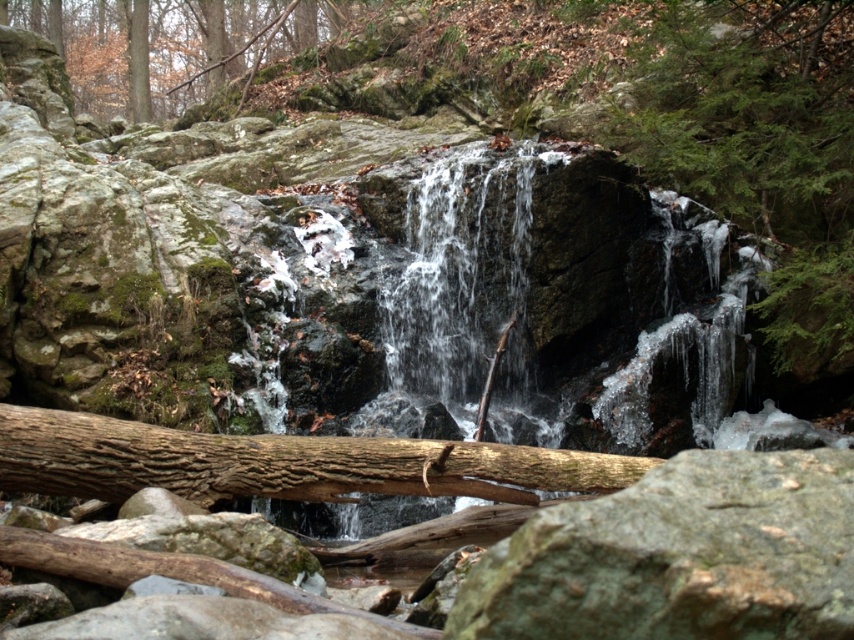
From the picture: Is gray rough rock at center above green textured rock at right?

Incorrect, gray rough rock at center is not positioned above green textured rock at right.

Which of these two, gray rough rock at center or green textured rock at right, stands taller?

green textured rock at right is taller.

Is point (670, 461) positioned after point (787, 52)?

No, it is not.

The image size is (854, 640). I want to click on gray rough rock at center, so click(679, 556).

Who is lower down, gray rough rock at center or green mossy rock at upper left?

Positioned lower is gray rough rock at center.

Is gray rough rock at center positioned in front of green mossy rock at upper left?

Yes.

Does point (466, 625) come behind point (91, 19)?

That is False.

Identify the location of gray rough rock at center. The width and height of the screenshot is (854, 640). (679, 556).

Does green textured rock at right appear on the left side of green mossy rock at upper left?

Incorrect, green textured rock at right is not on the left side of green mossy rock at upper left.

Is green textured rock at right above green mossy rock at upper left?

No.

Where is `green textured rock at right`? This screenshot has width=854, height=640. green textured rock at right is located at coordinates click(x=761, y=148).